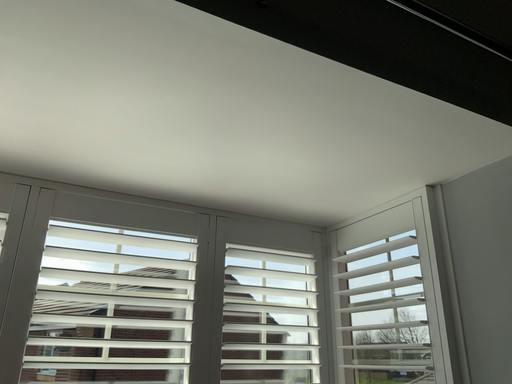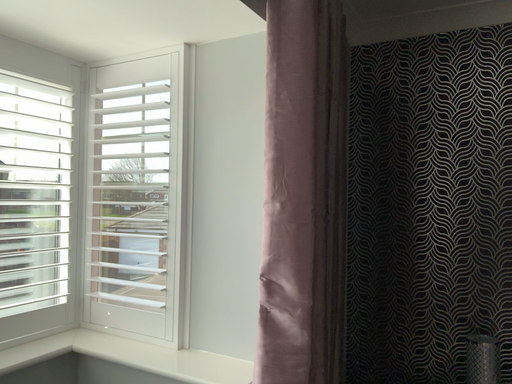
Question: How did the camera likely rotate when shooting the video?

Choices:
 (A) rotated left
 (B) rotated right

Answer: (B)